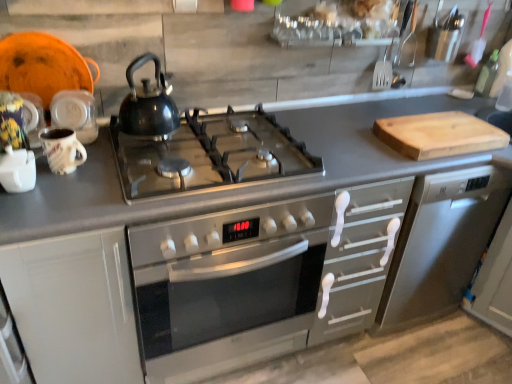
Question: From the image's perspective, is green glass bottle at upper right above or below wooden cutting board at right?

Choices:
 (A) below
 (B) above

Answer: (B)

Question: Does point (481, 94) appear closer or farther from the camera than point (475, 144)?

Choices:
 (A) farther
 (B) closer

Answer: (A)

Question: Estimate the real-world distances between objects in this image. Which object is farther from the green glass bottle at upper right?

Choices:
 (A) metallic stainless steel dishwasher at right
 (B) matte ceramic mug at upper left, the 2th appliance positioned from the front
 (C) glossy black kettle at center
 (D) stainless steel oven at center
 (E) white matte cabinet at left

Answer: (E)

Question: Which object is positioned closest to the metallic stainless steel dishwasher at right?

Choices:
 (A) stainless steel oven at center
 (B) glossy black kettle at center
 (C) white matte cabinet at left
 (D) green glass bottle at upper right
 (E) matte ceramic mug at upper left, which appears as the first appliance when viewed from the top

Answer: (A)